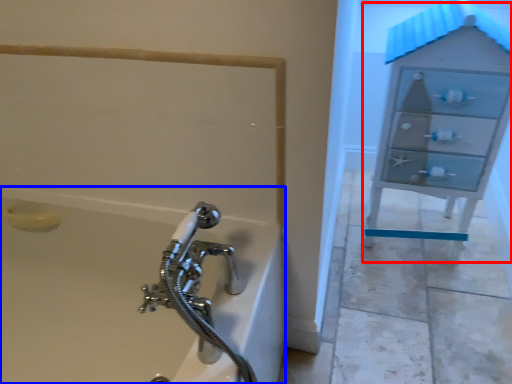
Question: Which object is further to the camera taking this photo, file cabinet (highlighted by a red box) or bathtub (highlighted by a blue box)?

Choices:
 (A) file cabinet
 (B) bathtub

Answer: (A)